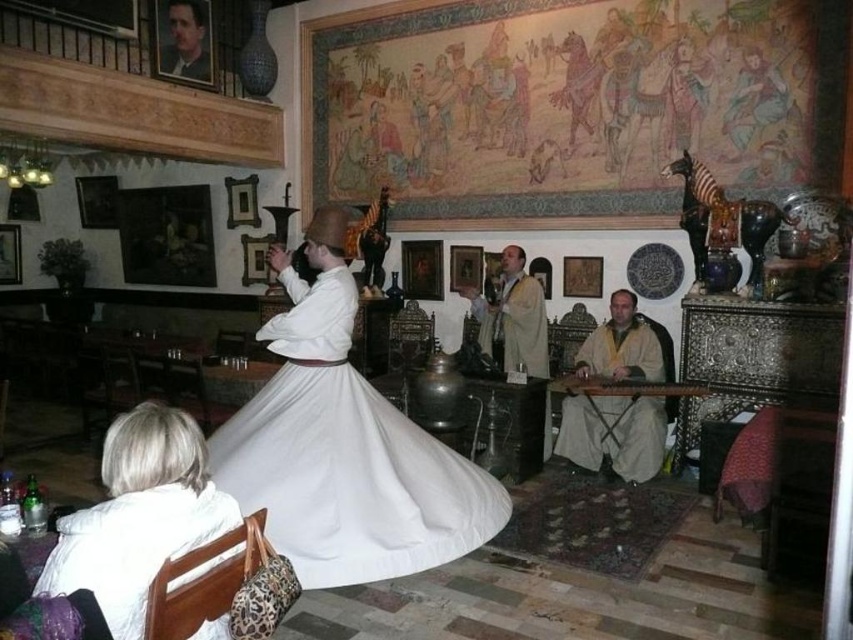
You are an interior designer planning to place a tall plant next to the white cotton dress at center and the beige woolen robe at right. Which object should the plant be placed next to to ensure it doesn not block the view of the shorter item?

The beige woolen robe at right is shorter than the white cotton dress at center. To avoid blocking the view of the shorter item, the tall plant should be placed next to the beige woolen robe at right.

You are a photographer standing in the center of the room. You want to take a photo of the white cotton dress at center and the beige woolen robe at right. The camera you have can only capture objects within a 1.5 meters range. Can both objects be in the same frame?

The white cotton dress at center is 1.83 meters away from the beige woolen robe at right. Since the camera can only capture objects within 1.5 meters, the distance between them exceeds the camera range. Therefore, both objects cannot be in the same frame.

You are an interior designer planning to place a new sofa in this traditional Middle Eastern room. The sofa must fit between the white cotton dress at center and the white clothed figure at center. If the sofa is 1.2 meters wide, will it fit?

The white cotton dress at center has a larger width than the white clothed figure at center. However, the exact dimensions of the space between them are not provided in the description. Therefore, it is uncertain whether the sofa will fit without additional measurements.